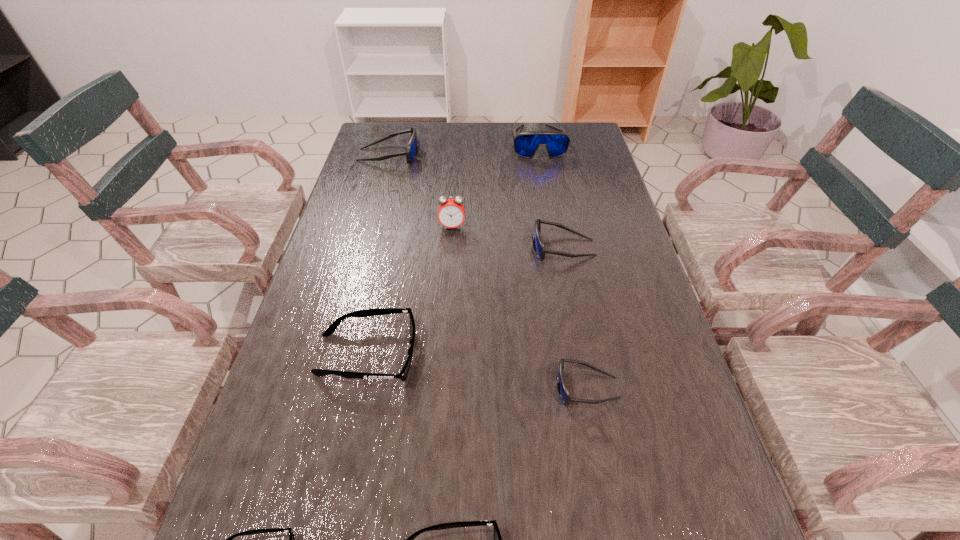
The height and width of the screenshot is (540, 960). I want to click on vacant space at the far edge, so click(540, 146).

Locate an element on the screen. free spot at the left edge of the desktop is located at coordinates (357, 177).

Image resolution: width=960 pixels, height=540 pixels. I want to click on vacant space at the right edge, so click(635, 259).

Identify the location of vacant space at the far left corner. The width and height of the screenshot is (960, 540). point(406,129).

I want to click on unoccupied area between the alarm clock and the second smallest blue sunglasses, so click(x=508, y=237).

The image size is (960, 540). Find the location of `vacant space in between the tallest sunglasses and the red alarm clock`. vacant space in between the tallest sunglasses and the red alarm clock is located at coordinates (x=495, y=185).

Identify the location of vacant area between the second nearest blue sunglasses and the sixth shortest object. The width and height of the screenshot is (960, 540). (476, 201).

What are the coordinates of `free space that is in between the nearest blue sunglasses and the farthest black sunglasses` in the screenshot? It's located at (477, 371).

This screenshot has width=960, height=540. Identify the location of free space that is in between the second smallest blue sunglasses and the biggest black sunglasses. [x=465, y=301].

Locate an element on the screen. The image size is (960, 540). object that ranks as the fifth closest to the nearest blue sunglasses is located at coordinates [x=291, y=535].